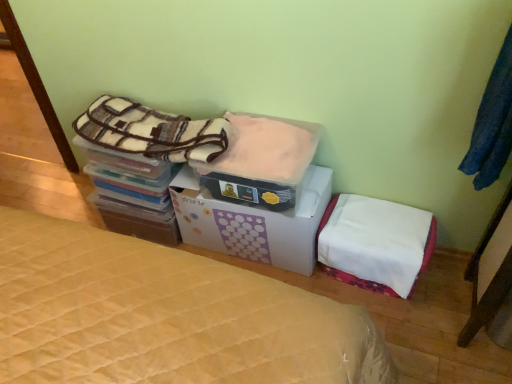
Question: Is plush fleece blanket at upper left, the 2th blanket from the right, directly adjacent to fuzzy pink blanket at center, positioned as the first blanket in right-to-left order?

Choices:
 (A) no
 (B) yes

Answer: (A)

Question: Does plush fleece blanket at upper left, the 2th blanket from the right, turn towards fuzzy pink blanket at center, positioned as the first blanket in right-to-left order?

Choices:
 (A) no
 (B) yes

Answer: (A)

Question: Are plush fleece blanket at upper left, which is counted as the first blanket, starting from the left, and fuzzy pink blanket at center, positioned as the first blanket in right-to-left order, far apart?

Choices:
 (A) yes
 (B) no

Answer: (B)

Question: Is plush fleece blanket at upper left, the 2th blanket from the right, positioned with its back to fuzzy pink blanket at center, which is the 2th blanket from left to right?

Choices:
 (A) no
 (B) yes

Answer: (A)

Question: From a real-world perspective, is plush fleece blanket at upper left, which is counted as the first blanket, starting from the left, located beneath fuzzy pink blanket at center, which is the 2th blanket from left to right?

Choices:
 (A) yes
 (B) no

Answer: (B)

Question: In terms of size, does white fabric mattress at lower right appear bigger or smaller than fuzzy pink blanket at center, which is the 2th blanket from left to right?

Choices:
 (A) small
 (B) big

Answer: (B)

Question: From their relative heights in the image, would you say white fabric mattress at lower right is taller or shorter than fuzzy pink blanket at center, which is the 2th blanket from left to right?

Choices:
 (A) short
 (B) tall

Answer: (B)

Question: Relative to fuzzy pink blanket at center, positioned as the first blanket in right-to-left order, is white fabric mattress at lower right in front or behind?

Choices:
 (A) behind
 (B) front

Answer: (A)

Question: From the image's perspective, is white fabric mattress at lower right positioned above or below fuzzy pink blanket at center, which is the 2th blanket from left to right?

Choices:
 (A) below
 (B) above

Answer: (A)

Question: Looking at their shapes, would you say fuzzy pink blanket at center, which is the 2th blanket from left to right, is wider or thinner than white cardboard box at center?

Choices:
 (A) thin
 (B) wide

Answer: (A)

Question: Is fuzzy pink blanket at center, positioned as the first blanket in right-to-left order, to the left or to the right of white cardboard box at center in the image?

Choices:
 (A) right
 (B) left

Answer: (A)

Question: Relative to white cardboard box at center, is fuzzy pink blanket at center, which is the 2th blanket from left to right, in front or behind?

Choices:
 (A) behind
 (B) front

Answer: (B)

Question: Considering the positions of fuzzy pink blanket at center, which is the 2th blanket from left to right, and white cardboard box at center in the image, is fuzzy pink blanket at center, which is the 2th blanket from left to right, taller or shorter than white cardboard box at center?

Choices:
 (A) short
 (B) tall

Answer: (A)

Question: Does point (493, 168) appear closer or farther from the camera than point (382, 203)?

Choices:
 (A) farther
 (B) closer

Answer: (B)

Question: In the image, is dark blue fabric at upper right on the left side or the right side of white fabric mattress at lower right?

Choices:
 (A) right
 (B) left

Answer: (A)